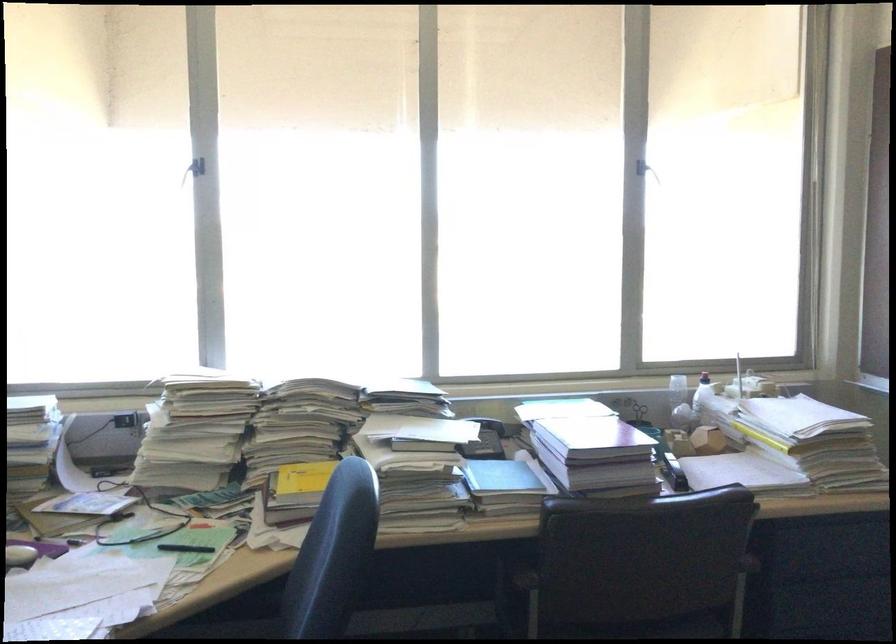
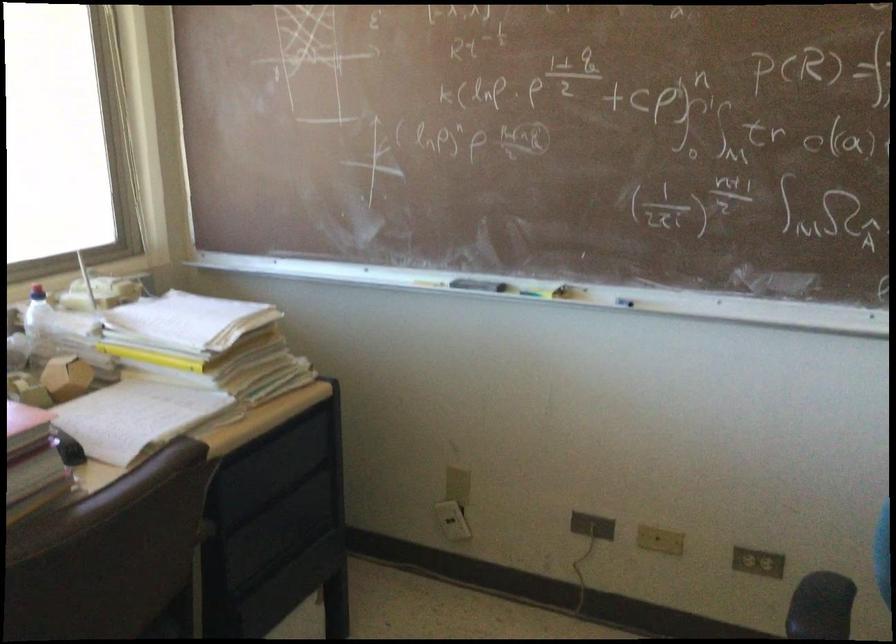
Where in the second image is the point corresponding to point 745,471 from the first image?

(135, 417)